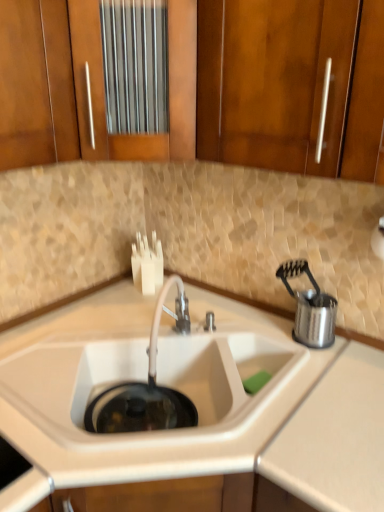
Question: Are stainless steel utensil holder at right and wooden cabinet at upper center, marked as the first cabinetry in a right-to-left arrangement, located far from each other?

Choices:
 (A) no
 (B) yes

Answer: (A)

Question: From a real-world perspective, is stainless steel utensil holder at right physically above wooden cabinet at upper center, marked as the first cabinetry in a right-to-left arrangement?

Choices:
 (A) no
 (B) yes

Answer: (A)

Question: Can you confirm if stainless steel utensil holder at right is shorter than wooden cabinet at upper center, marked as the first cabinetry in a right-to-left arrangement?

Choices:
 (A) no
 (B) yes

Answer: (B)

Question: Can you confirm if stainless steel utensil holder at right is taller than wooden cabinet at upper center, acting as the second cabinetry starting from the left?

Choices:
 (A) yes
 (B) no

Answer: (B)

Question: Is stainless steel utensil holder at right located outside wooden cabinet at upper center, marked as the first cabinetry in a right-to-left arrangement?

Choices:
 (A) yes
 (B) no

Answer: (A)

Question: Based on their sizes in the image, would you say white matte sink at center is bigger or smaller than wooden cabinet at upper left, the first cabinetry viewed from the left?

Choices:
 (A) big
 (B) small

Answer: (A)

Question: In terms of height, does white matte sink at center look taller or shorter compared to wooden cabinet at upper left, the first cabinetry viewed from the left?

Choices:
 (A) tall
 (B) short

Answer: (B)

Question: From the image's perspective, relative to wooden cabinet at upper left, the first cabinetry viewed from the left, is white matte sink at center above or below?

Choices:
 (A) below
 (B) above

Answer: (A)

Question: Is white matte sink at center inside or outside of wooden cabinet at upper left, the second cabinetry when ordered from right to left?

Choices:
 (A) inside
 (B) outside

Answer: (B)

Question: Considering their positions, is stainless steel utensil holder at right located in front of or behind satin nickel faucet at center?

Choices:
 (A) behind
 (B) front

Answer: (A)

Question: Based on their sizes in the image, would you say stainless steel utensil holder at right is bigger or smaller than satin nickel faucet at center?

Choices:
 (A) small
 (B) big

Answer: (B)

Question: Is stainless steel utensil holder at right taller or shorter than satin nickel faucet at center?

Choices:
 (A) short
 (B) tall

Answer: (B)

Question: Does point (311, 306) appear closer or farther from the camera than point (183, 312)?

Choices:
 (A) closer
 (B) farther

Answer: (A)

Question: From a real-world perspective, relative to satin nickel faucet at center, is white matte sink at center vertically above or below?

Choices:
 (A) below
 (B) above

Answer: (A)

Question: From the image's perspective, is white matte sink at center located above or below satin nickel faucet at center?

Choices:
 (A) above
 (B) below

Answer: (B)